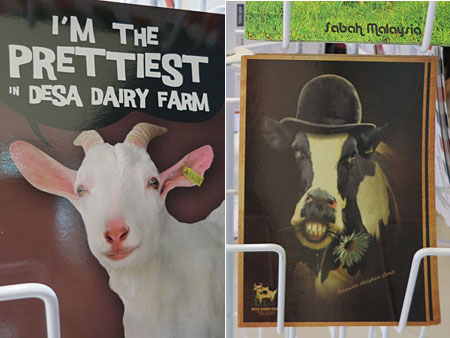
Locate an element on the screen. The width and height of the screenshot is (450, 338). metal bracket is located at coordinates (57, 305), (263, 247), (417, 262).